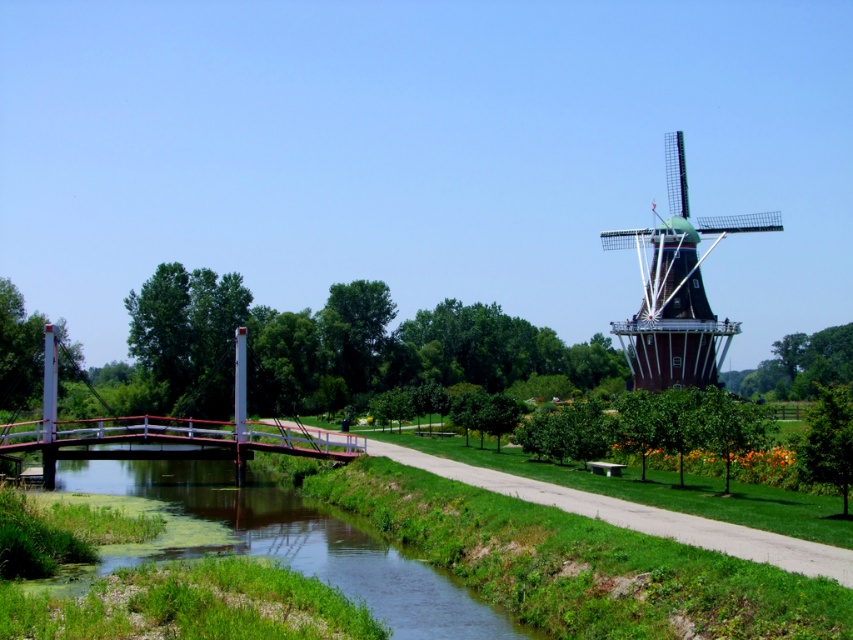
Question: Is green grassy river at lower left to the right of green wooden windmill at right from the viewer's perspective?

Choices:
 (A) no
 (B) yes

Answer: (A)

Question: Which point is closer to the camera?

Choices:
 (A) green wooden windmill at right
 (B) metallic bridge at left
 (C) metallic bridge at center-left
 (D) green grassy river at lower left

Answer: (D)

Question: Which object is closer to the camera taking this photo?

Choices:
 (A) green grassy river at lower left
 (B) green wooden windmill at right
 (C) metallic bridge at center-left
 (D) metallic bridge at left

Answer: (A)

Question: Among these objects, which one is nearest to the camera?

Choices:
 (A) green grassy river at lower left
 (B) green wooden windmill at right
 (C) metallic bridge at center-left

Answer: (A)

Question: Is green grassy river at lower left behind green wooden windmill at right?

Choices:
 (A) no
 (B) yes

Answer: (A)

Question: Is green wooden windmill at right positioned before metallic bridge at left?

Choices:
 (A) yes
 (B) no

Answer: (B)